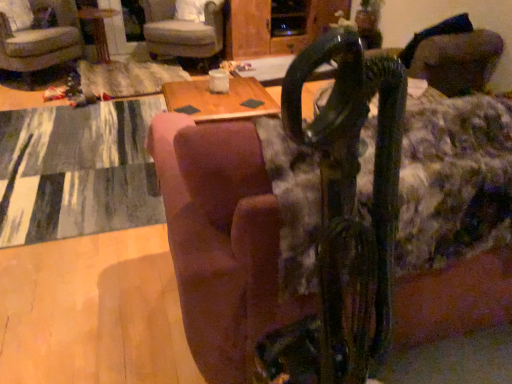
Question: Is brown fabric couch at center outside textured gray rug at lower left?

Choices:
 (A) yes
 (B) no

Answer: (A)

Question: Is brown fabric couch at center in contact with textured gray rug at lower left?

Choices:
 (A) yes
 (B) no

Answer: (B)

Question: Does brown fabric couch at center have a larger size compared to textured gray rug at lower left?

Choices:
 (A) no
 (B) yes

Answer: (B)

Question: Is brown fabric couch at center thinner than textured gray rug at lower left?

Choices:
 (A) yes
 (B) no

Answer: (A)

Question: From the image's perspective, would you say brown fabric couch at center is shown under textured gray rug at lower left?

Choices:
 (A) yes
 (B) no

Answer: (A)

Question: From a real-world perspective, is velvet beige armchair at upper left, placed as the second chair when sorted from right to left, positioned above or below velvet-like gray armchair at upper center, arranged as the second chair when viewed from the left?

Choices:
 (A) below
 (B) above

Answer: (B)

Question: From their relative heights in the image, would you say velvet beige armchair at upper left, placed as the second chair when sorted from right to left, is taller or shorter than velvet-like gray armchair at upper center, arranged as the second chair when viewed from the left?

Choices:
 (A) tall
 (B) short

Answer: (A)

Question: Relative to velvet-like gray armchair at upper center, which is the first chair in right-to-left order, is velvet beige armchair at upper left, which appears as the 1th chair when viewed from the left, in front or behind?

Choices:
 (A) behind
 (B) front

Answer: (B)

Question: Considering the positions of velvet beige armchair at upper left, which appears as the 1th chair when viewed from the left, and velvet-like gray armchair at upper center, which is the first chair in right-to-left order, in the image, is velvet beige armchair at upper left, which appears as the 1th chair when viewed from the left, wider or thinner than velvet-like gray armchair at upper center, which is the first chair in right-to-left order,?

Choices:
 (A) wide
 (B) thin

Answer: (B)

Question: From a real-world perspective, is brown fabric couch at center physically located above or below velvet-like gray armchair at upper center, arranged as the second chair when viewed from the left?

Choices:
 (A) below
 (B) above

Answer: (B)

Question: Considering the positions of brown fabric couch at center and velvet-like gray armchair at upper center, which is the first chair in right-to-left order, in the image, is brown fabric couch at center taller or shorter than velvet-like gray armchair at upper center, which is the first chair in right-to-left order,?

Choices:
 (A) short
 (B) tall

Answer: (B)

Question: Choose the correct answer: Is brown fabric couch at center inside velvet-like gray armchair at upper center, which is the first chair in right-to-left order, or outside it?

Choices:
 (A) inside
 (B) outside

Answer: (B)

Question: Considering their positions, is brown fabric couch at center located in front of or behind velvet-like gray armchair at upper center, arranged as the second chair when viewed from the left?

Choices:
 (A) front
 (B) behind

Answer: (A)

Question: Is velvet-like gray armchair at upper center, arranged as the second chair when viewed from the left, wider or thinner than wooden table at center?

Choices:
 (A) wide
 (B) thin

Answer: (A)

Question: From the image's perspective, is velvet-like gray armchair at upper center, arranged as the second chair when viewed from the left, located above or below wooden table at center?

Choices:
 (A) below
 (B) above

Answer: (B)